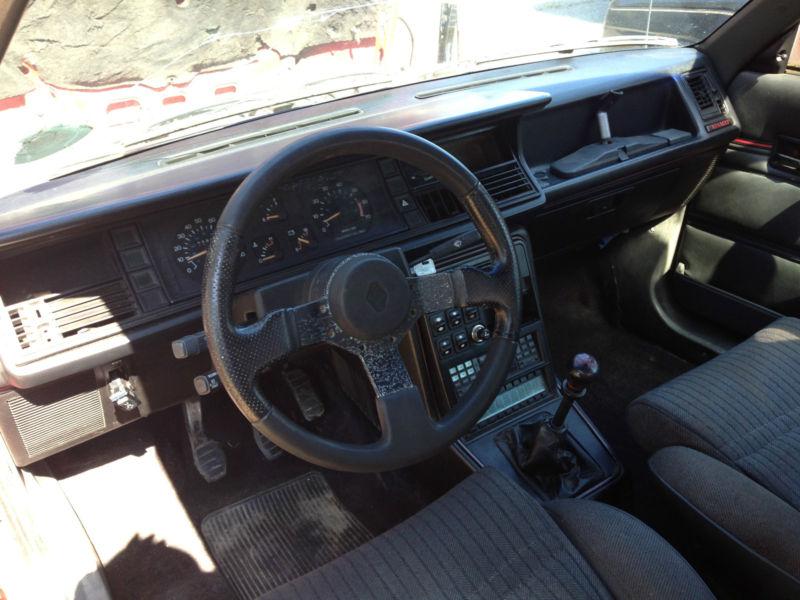
In order to click on windows in this screenshot , I will do `click(512, 33)`, `click(792, 58)`.